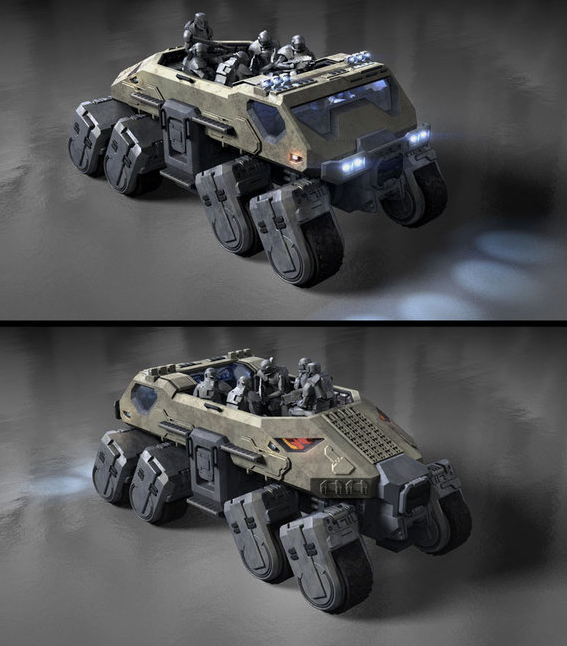
I want to click on window, so click(142, 393), click(263, 110).